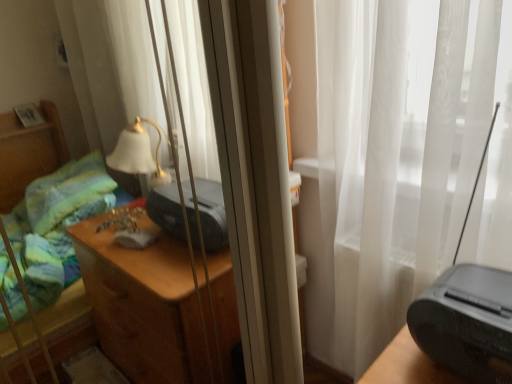
Question: In terms of size, does black plastic radio at right appear bigger or smaller than matte black printer at center, arranged as the second printer when viewed from the front?

Choices:
 (A) small
 (B) big

Answer: (B)

Question: From a real-world perspective, is black plastic radio at right above or below matte black printer at center, arranged as the 2th printer when viewed from the right?

Choices:
 (A) above
 (B) below

Answer: (A)

Question: Which object is the closest to the white sheer curtain at center?

Choices:
 (A) black plastic radio at right
 (B) matte black printer at center, arranged as the second printer when viewed from the front
 (C) black plastic printer at right, the 2th printer from the left

Answer: (B)

Question: Based on their relative distances, which object is farther from the matte black printer at center, arranged as the second printer when viewed from the front?

Choices:
 (A) white sheer curtain at center
 (B) black plastic printer at right, which is counted as the 1th printer, starting from the front
 (C) black plastic radio at right

Answer: (B)